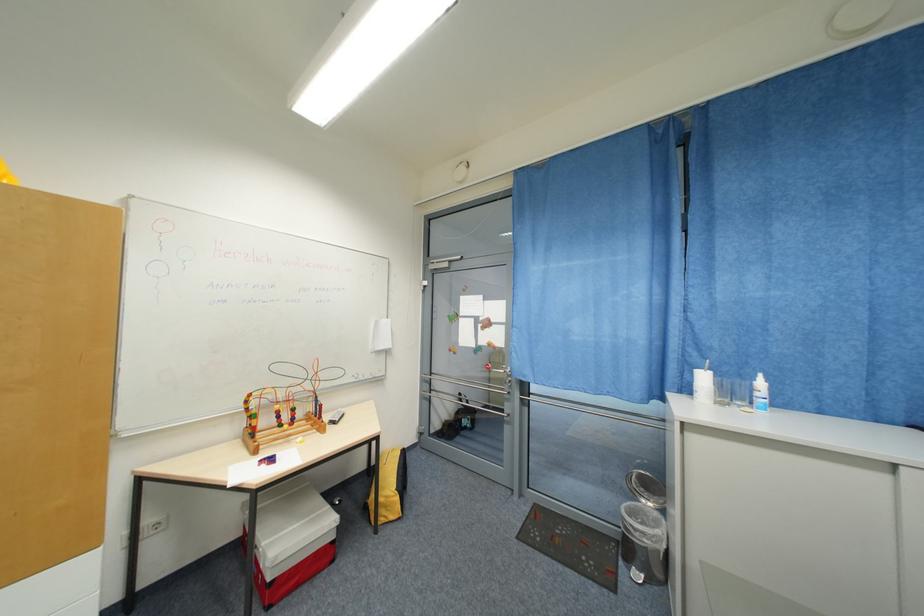
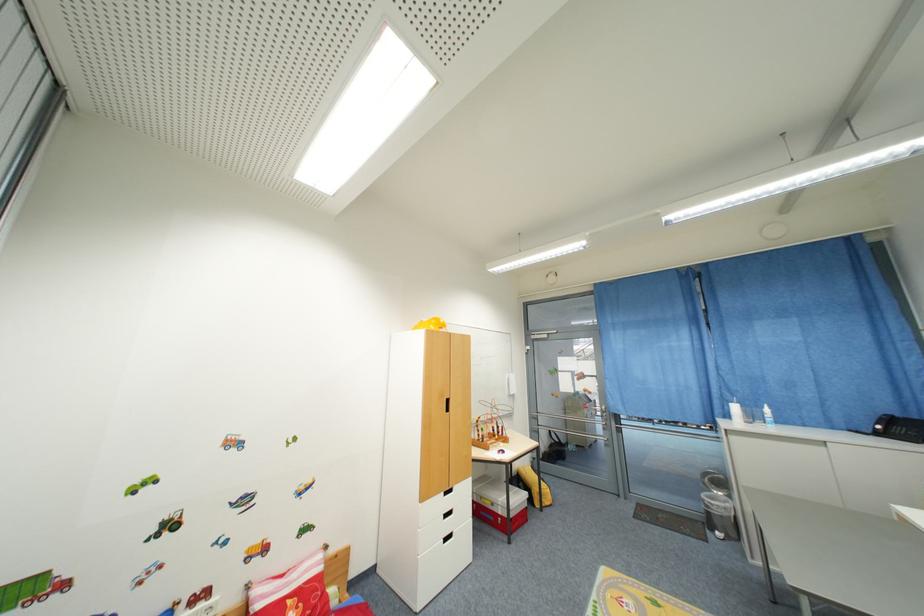
The point at (757,391) is marked in the first image. Where is the corresponding point in the second image?

(768, 415)